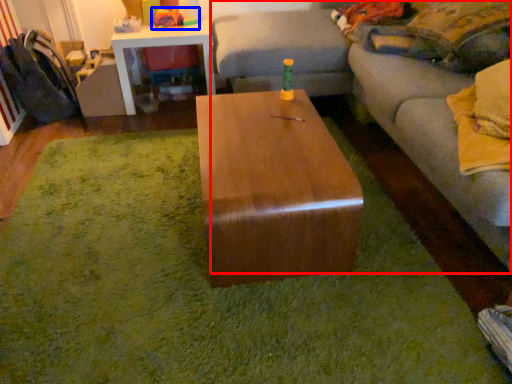
Question: Which object is closer to the camera taking this photo, studio couch (highlighted by a red box) or toy (highlighted by a blue box)?

Choices:
 (A) studio couch
 (B) toy

Answer: (A)